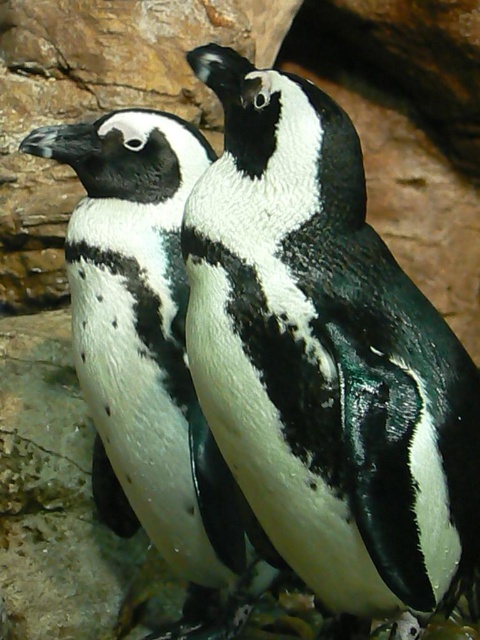
Between black matte penguin at center and black and white feathers at center, which one is positioned lower?

Positioned lower is black and white feathers at center.

Where is `black matte penguin at center`? Image resolution: width=480 pixels, height=640 pixels. black matte penguin at center is located at coordinates (326, 358).

Locate an element on the screen. The width and height of the screenshot is (480, 640). black matte penguin at center is located at coordinates (326, 358).